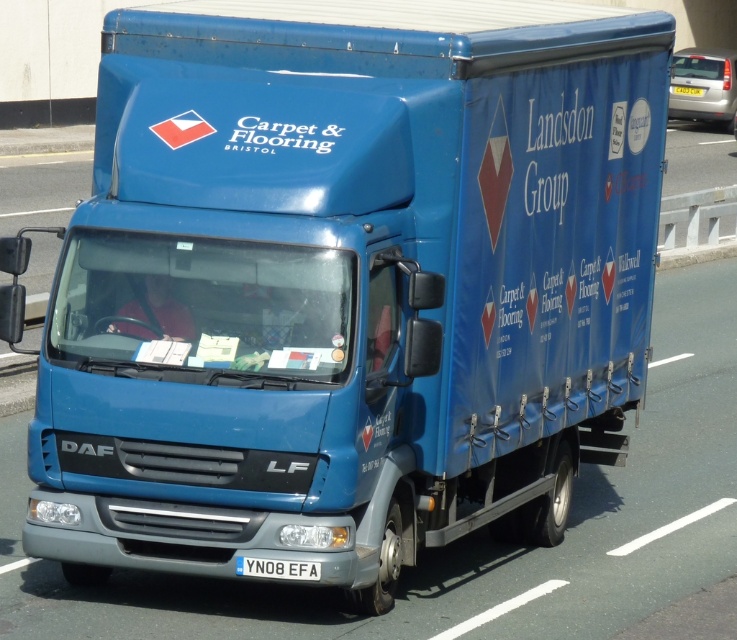
Question: Does white plastic license plate at bottom have a lesser width compared to yellow metallic license plate at center?

Choices:
 (A) no
 (B) yes

Answer: (B)

Question: Does white plastic license plate at bottom appear on the right side of yellow metallic license plate at center?

Choices:
 (A) yes
 (B) no

Answer: (B)

Question: In this image, where is white plastic license plate at bottom located relative to yellow metallic license plate at center?

Choices:
 (A) right
 (B) left

Answer: (B)

Question: Which object is closer to the camera taking this photo?

Choices:
 (A) yellow metallic license plate at center
 (B) white plastic license plate at bottom

Answer: (B)